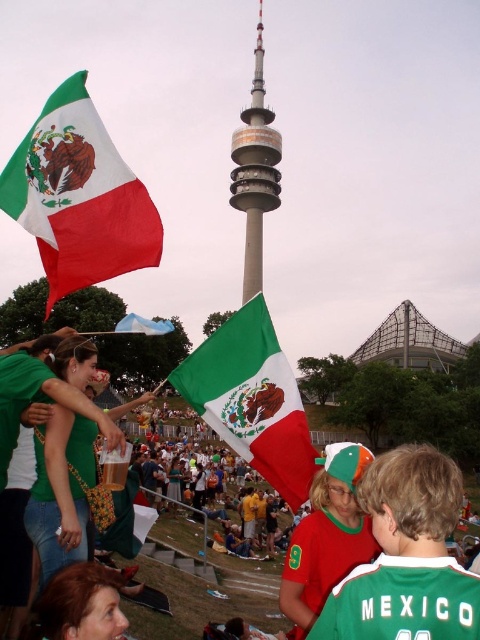
Question: Can you confirm if red fabric flag at upper left is thinner than smooth metallic tower at center?

Choices:
 (A) no
 (B) yes

Answer: (A)

Question: Which is nearer to the matte green jersey at center?

Choices:
 (A) red fabric flag at upper left
 (B) matte fabric flag at center
 (C) smooth metallic tower at center
 (D) green jersey at center

Answer: (D)

Question: Among these points, which one is farthest from the camera?

Choices:
 (A) (335, 556)
 (B) (396, 620)

Answer: (A)

Question: Does green jersey at center have a greater width compared to matte fabric flag at center?

Choices:
 (A) yes
 (B) no

Answer: (B)

Question: Where is matte fabric flag at center located in relation to smooth metallic tower at center in the image?

Choices:
 (A) above
 (B) below

Answer: (B)

Question: Which of the following is the closest to the observer?

Choices:
 (A) (301, 572)
 (B) (442, 492)
 (C) (277, 141)

Answer: (B)